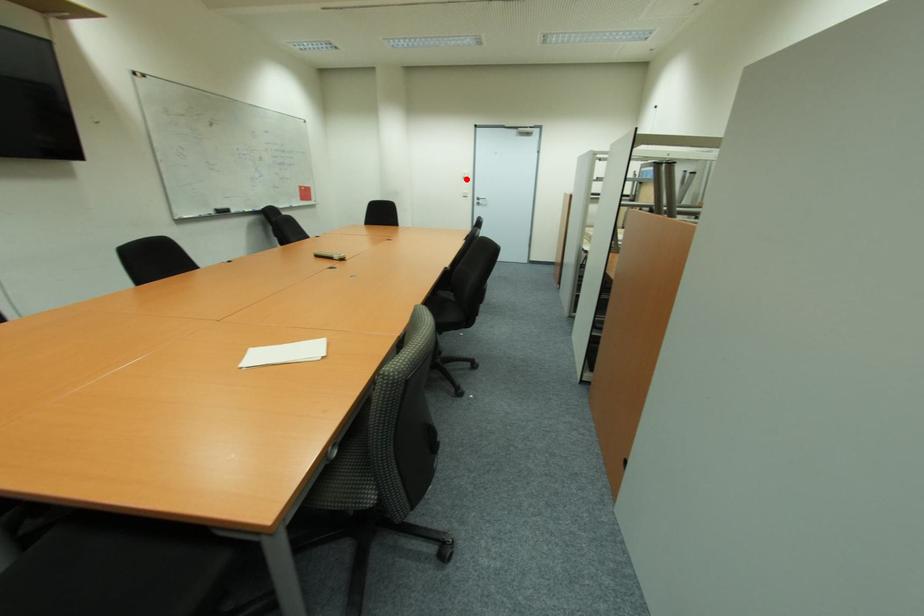
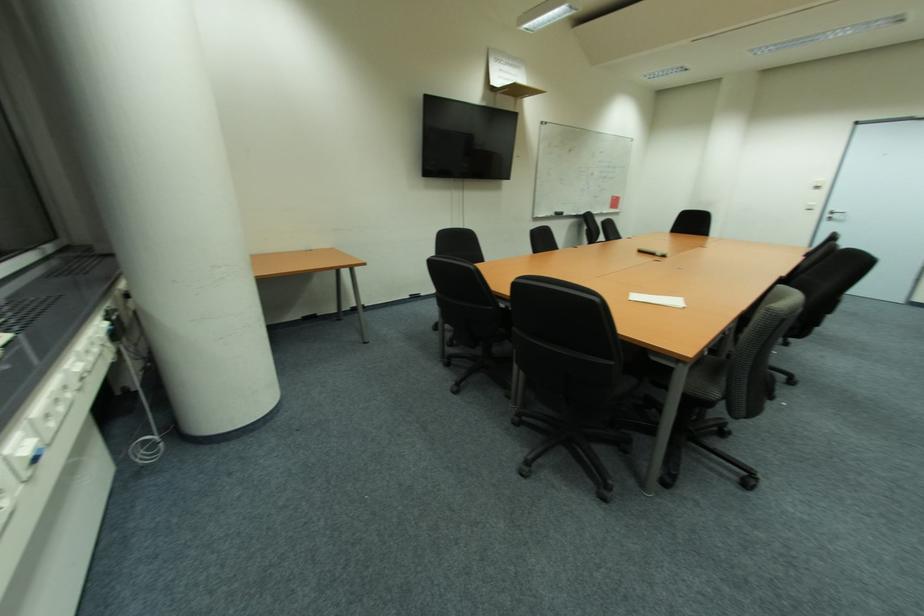
Find the pixel in the second image that matches the highlighted location in the first image.

(820, 188)